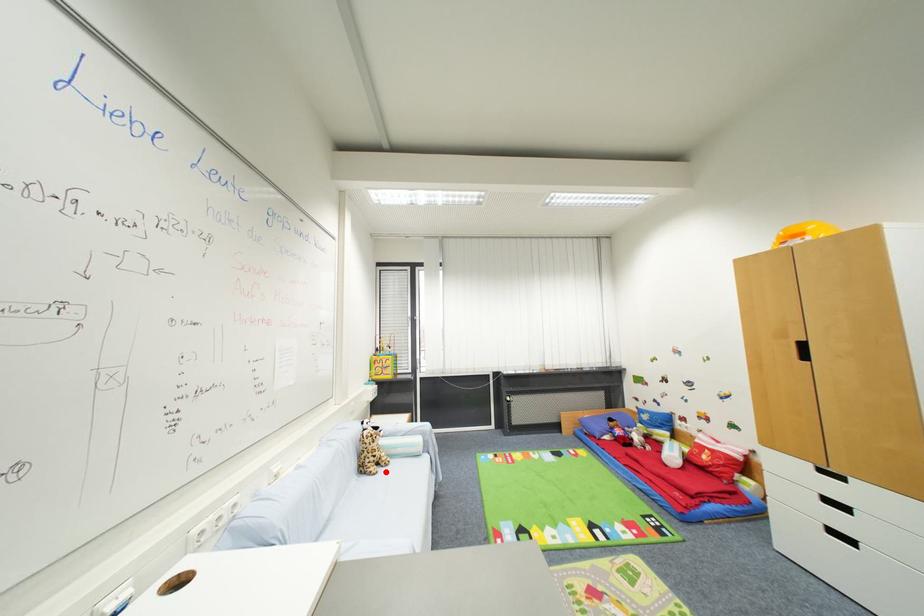
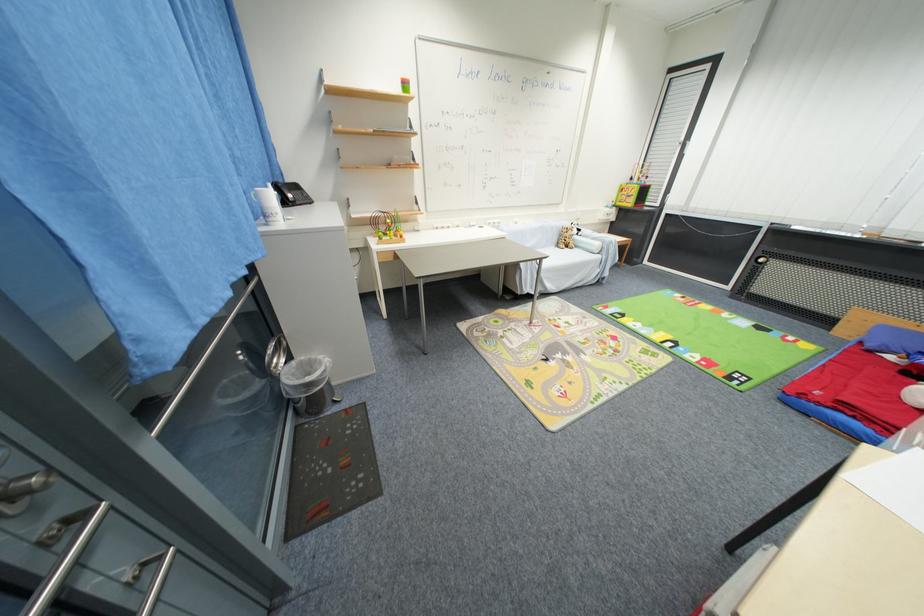
Question: I am providing you with two images of the same scene from different viewpoints. A red point is marked on the first image. At the location where the point appears in image 1, is it still visible in image 2?

Choices:
 (A) Yes
 (B) No

Answer: (A)